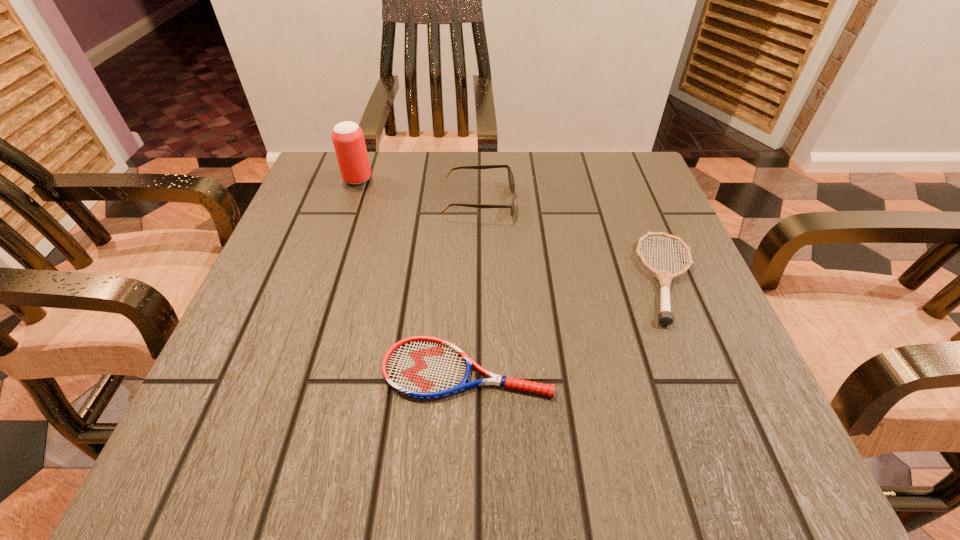
Where is `the leftmost object`? This screenshot has height=540, width=960. the leftmost object is located at coordinates (348, 139).

Locate an element on the screen. Image resolution: width=960 pixels, height=540 pixels. beer can is located at coordinates (348, 139).

This screenshot has width=960, height=540. I want to click on sunglasses, so click(x=510, y=175).

In order to click on the taller tennis racket in this screenshot , I will do `click(665, 317)`.

Where is `the right tennis racket`? This screenshot has width=960, height=540. the right tennis racket is located at coordinates (665, 317).

What are the coordinates of `the nearer tennis racket` in the screenshot? It's located at (422, 367).

The width and height of the screenshot is (960, 540). I want to click on the nearest object, so click(x=422, y=367).

Locate an element on the screen. free space located 0.280m on the front of the leftmost object is located at coordinates (324, 276).

At what (x,y) coordinates should I click in order to perform the action: click on vacant space situated on the lenses of the third shortest object. Please return your answer as a coordinate pair (x, y). The image size is (960, 540). Looking at the image, I should click on (564, 201).

Where is `vacant space situated on the front of the rightmost object`? vacant space situated on the front of the rightmost object is located at coordinates (723, 407).